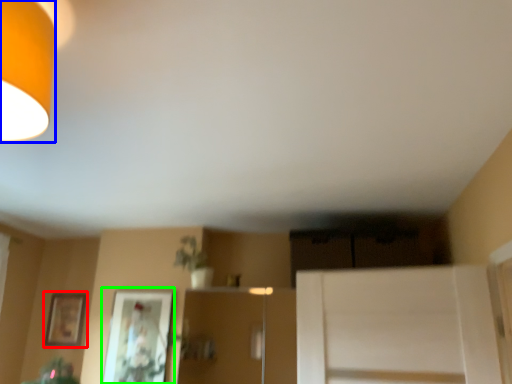
Question: Based on their relative distances, which object is farther from picture frame (highlighted by a red box)? Choose from lamp (highlighted by a blue box) and picture frame (highlighted by a green box).

Choices:
 (A) lamp
 (B) picture frame

Answer: (A)